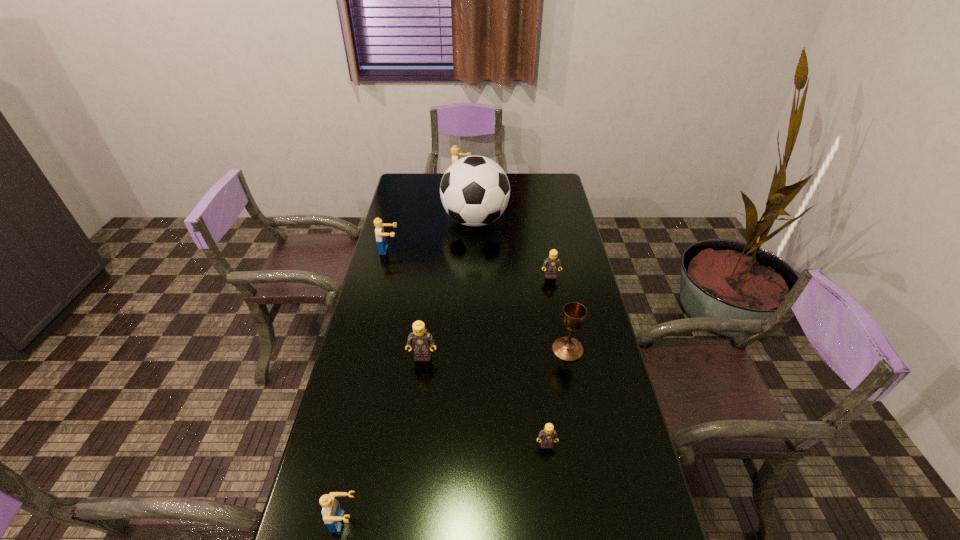
At what (x,y) coordinates should I click in order to perform the action: click on free point between the second nearest Lego and the third nearest Lego. Please return your answer as a coordinate pair (x, y). The width and height of the screenshot is (960, 540). Looking at the image, I should click on (485, 401).

What are the coordinates of `empty location between the nearest Lego and the biggest tan Lego` in the screenshot? It's located at (384, 439).

The height and width of the screenshot is (540, 960). I want to click on vacant region between the second smallest blue Lego and the nearest object, so click(x=367, y=386).

This screenshot has height=540, width=960. In order to click on vacant space in between the chalice and the second farthest blue Lego in this screenshot , I will do `click(478, 300)`.

At what (x,y) coordinates should I click in order to perform the action: click on empty location between the second nearest Lego and the chalice. Please return your answer as a coordinate pair (x, y). Looking at the image, I should click on (557, 397).

The height and width of the screenshot is (540, 960). In order to click on free spot between the third farthest object and the chalice in this screenshot , I will do `click(478, 300)`.

Where is `object that stands as the fifth closest to the chalice`? object that stands as the fifth closest to the chalice is located at coordinates (332, 514).

Where is `object that can be found as the closest to the tallest object`? The width and height of the screenshot is (960, 540). object that can be found as the closest to the tallest object is located at coordinates [379, 230].

Find the location of a particular element. The width and height of the screenshot is (960, 540). the fifth closest Lego to the soccer ball is located at coordinates (547, 436).

At what (x,y) coordinates should I click in order to perform the action: click on Lego that is the third closest to the rightmost blue Lego. Please return your answer as a coordinate pair (x, y). Looking at the image, I should click on (420, 339).